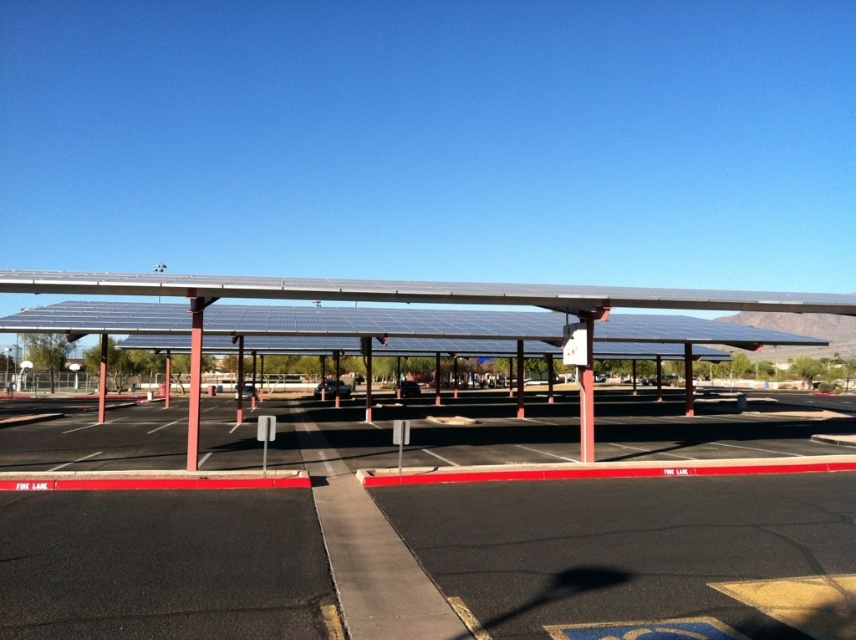
Who is lower down, metallic solar panels at center or metallic pole at center?

Positioned lower is metallic solar panels at center.

I want to click on metallic solar panels at center, so click(x=434, y=300).